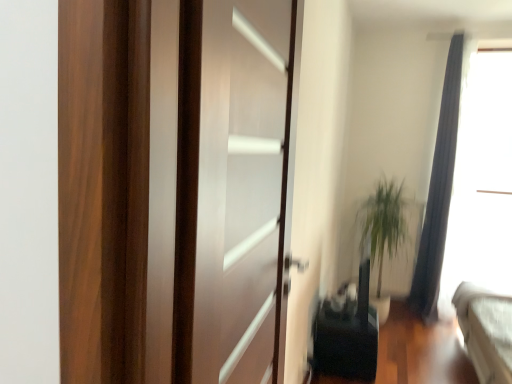
Locate an element on the screen. silky gray curtain at right is located at coordinates (439, 191).

Locate an element on the screen. transparent glass door at center is located at coordinates coord(233,188).

In order to click on transparent glass window screen at upper right in this screenshot , I will do `click(477, 164)`.

From the image's perspective, who appears lower, black matte speaker at lower center or green leafy plant at right?

From the image's view, black matte speaker at lower center is below.

From a real-world perspective, which is physically above, black matte speaker at lower center or green leafy plant at right?

green leafy plant at right.

Looking at this image, is black matte speaker at lower center next to green leafy plant at right?

No, black matte speaker at lower center is not in contact with green leafy plant at right.

In terms of width, does black matte speaker at lower center look wider or thinner when compared to green leafy plant at right?

black matte speaker at lower center is wider than green leafy plant at right.

Considering the positions of point (246, 370) and point (433, 283), is point (246, 370) closer or farther from the camera than point (433, 283)?

Point (246, 370) is closer to the camera than point (433, 283).

Is silky gray curtain at right at the back of transparent glass door at center?

No.

Is transparent glass door at center not inside silky gray curtain at right?

Yes, transparent glass door at center is located beyond the bounds of silky gray curtain at right.

Can you confirm if transparent glass door at center is taller than silky gray curtain at right?

No, transparent glass door at center is not taller than silky gray curtain at right.

Is silky gray curtain at right not inside black matte speaker at lower center?

Yes, silky gray curtain at right is not within black matte speaker at lower center.

From the image's perspective, is silky gray curtain at right under black matte speaker at lower center?

No.

Is silky gray curtain at right at the right side of black matte speaker at lower center?

Correct, you'll find silky gray curtain at right to the right of black matte speaker at lower center.

Can you see silky gray curtain at right touching black matte speaker at lower center?

silky gray curtain at right and black matte speaker at lower center are not in contact.

Is green leafy plant at right spatially inside black matte speaker at lower center, or outside of it?

green leafy plant at right is not inside black matte speaker at lower center, it's outside.

Which of these two, green leafy plant at right or black matte speaker at lower center, is bigger?

green leafy plant at right is bigger.

Does green leafy plant at right touch black matte speaker at lower center?

They are not placed beside each other.

Between green leafy plant at right and black matte speaker at lower center, which one is positioned in front?

Positioned in front is black matte speaker at lower center.

Between point (387, 234) and point (442, 214), which one is positioned in front?

The point (387, 234) is closer to the camera.

Does green leafy plant at right have a lesser height compared to silky gray curtain at right?

Correct, green leafy plant at right is not as tall as silky gray curtain at right.

Which of these two, green leafy plant at right or silky gray curtain at right, is smaller?

green leafy plant at right.

In terms of width, does green leafy plant at right look wider or thinner when compared to silky gray curtain at right?

In the image, green leafy plant at right appears to be more narrow than silky gray curtain at right.

Is transparent glass window screen at upper right bigger or smaller than green leafy plant at right?

Considering their sizes, transparent glass window screen at upper right takes up more space than green leafy plant at right.

Based on the photo, in the image, is transparent glass window screen at upper right positioned in front of or behind green leafy plant at right?

Visually, transparent glass window screen at upper right is located in front of green leafy plant at right.

At what (x,y) coordinates should I click in order to perform the action: click on plant behind the transparent glass window screen at upper right. Please return your answer as a coordinate pair (x, y). The height and width of the screenshot is (384, 512). Looking at the image, I should click on pos(387,230).

Is transparent glass window screen at upper right facing towards green leafy plant at right?

No, transparent glass window screen at upper right does not turn towards green leafy plant at right.

Is transparent glass door at center positioned with its back to black matte speaker at lower center?

No, transparent glass door at center's orientation is not away from black matte speaker at lower center.

Locate an element on the screen. Image resolution: width=512 pixels, height=384 pixels. screen door located in front of the black matte speaker at lower center is located at coordinates tap(233, 188).

From a real-world perspective, is transparent glass door at center over black matte speaker at lower center?

Correct, in the physical world, transparent glass door at center is higher than black matte speaker at lower center.

Is transparent glass door at center spatially inside black matte speaker at lower center, or outside of it?

transparent glass door at center is located beyond the bounds of black matte speaker at lower center.

Find the location of a particular element. The image size is (512, 384). plant above the black matte speaker at lower center (from a real-world perspective) is located at coordinates (387, 230).

I want to click on curtain behind the transparent glass door at center, so click(439, 191).

From the image, which object appears to be farther from black matte speaker at lower center, green leafy plant at right or transparent glass door at center?

The object further to black matte speaker at lower center is transparent glass door at center.

Based on their spatial positions, is silky gray curtain at right or green leafy plant at right closer to transparent glass door at center?

green leafy plant at right.

From the image, which object appears to be farther from black matte speaker at lower center, transparent glass door at center or green leafy plant at right?

Based on the image, transparent glass door at center appears to be further to black matte speaker at lower center.

Based on their spatial positions, is black matte speaker at lower center or silky gray curtain at right further from transparent glass door at center?

silky gray curtain at right lies further to transparent glass door at center than the other object.

From the picture: Based on their spatial positions, is green leafy plant at right or transparent glass door at center further from silky gray curtain at right?

transparent glass door at center lies further to silky gray curtain at right than the other object.

Which object lies further to the anchor point transparent glass door at center, silky gray curtain at right or black matte speaker at lower center?

Based on the image, silky gray curtain at right appears to be further to transparent glass door at center.

Which object lies further to the anchor point transparent glass window screen at upper right, green leafy plant at right or silky gray curtain at right?

Based on the image, green leafy plant at right appears to be further to transparent glass window screen at upper right.

When comparing their distances from transparent glass window screen at upper right, does silky gray curtain at right or black matte speaker at lower center seem further?

The object further to transparent glass window screen at upper right is black matte speaker at lower center.

Locate an element on the screen. window screen positioned between black matte speaker at lower center and green leafy plant at right from near to far is located at coordinates (477, 164).

The image size is (512, 384). Identify the location of curtain located between black matte speaker at lower center and transparent glass window screen at upper right in the left-right direction. (439, 191).

This screenshot has width=512, height=384. Find the location of `furniture between transparent glass door at center and green leafy plant at right from front to back`. furniture between transparent glass door at center and green leafy plant at right from front to back is located at coordinates (345, 343).

The width and height of the screenshot is (512, 384). Find the location of `curtain between transparent glass door at center and green leafy plant at right in the front-back direction`. curtain between transparent glass door at center and green leafy plant at right in the front-back direction is located at coordinates (439, 191).